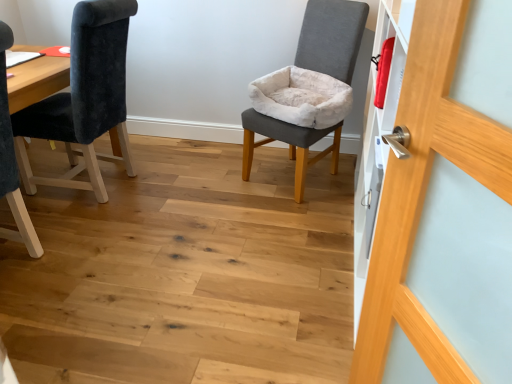
Find the location of a particular element. unoccupied region to the right of velvet dark blue chair at left, the 2th chair viewed from the right is located at coordinates (182, 185).